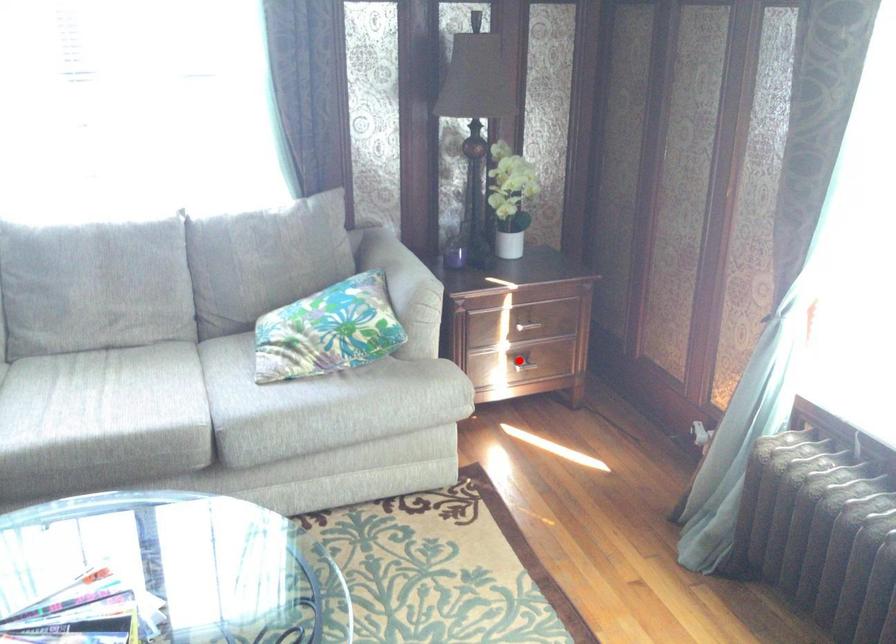
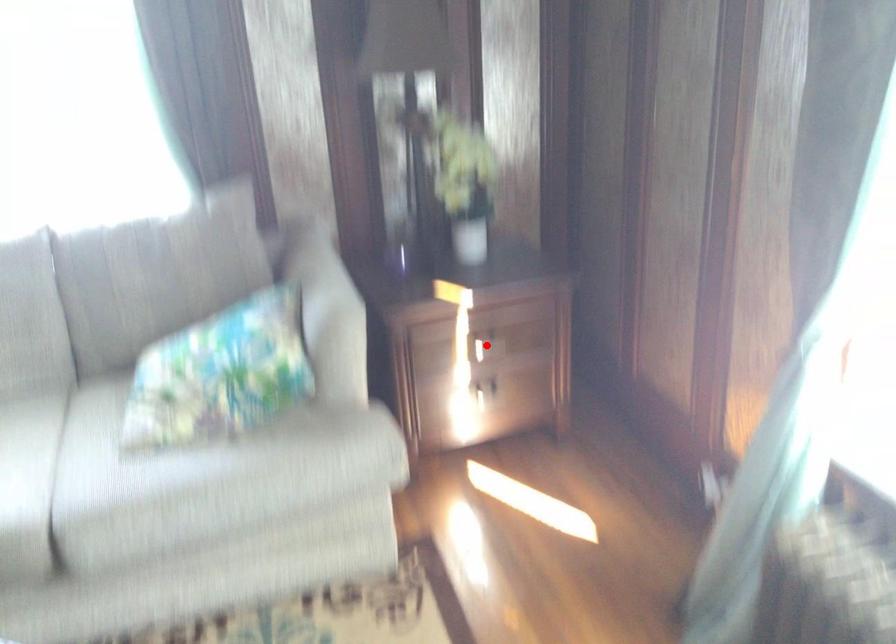
I am providing you with two images of the same scene from different viewpoints. A red point is marked on the first image and another point is marked on the second image. Is the marked point in image1 the same physical position as the marked point in image2?

No